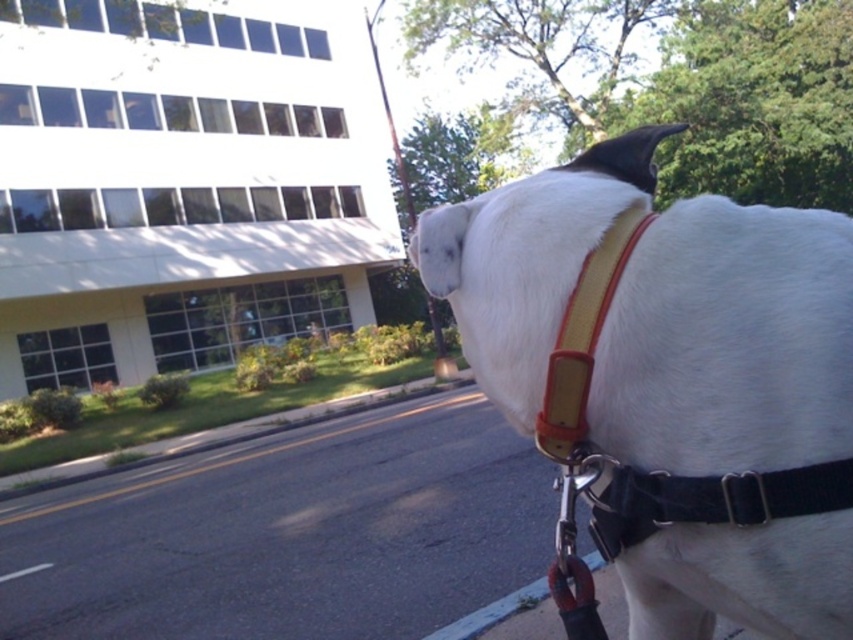
You are a delivery robot navigating a path between the white matte dog at center and the yellow leather strap at upper center. Which object is positioned higher in the image?

The yellow leather strap at upper center is positioned higher than the white matte dog at center in the image.

You are a delivery robot that needs to pass between the white matte dog at center and the black leather strap at right. Your width is 0.8 meters. Can you fit through the space between them?

The white matte dog at center might be wider than the black leather strap at right, so the space between them may not be wide enough for the robot to pass through safely. It is recommended to check the exact width before attempting to move through.